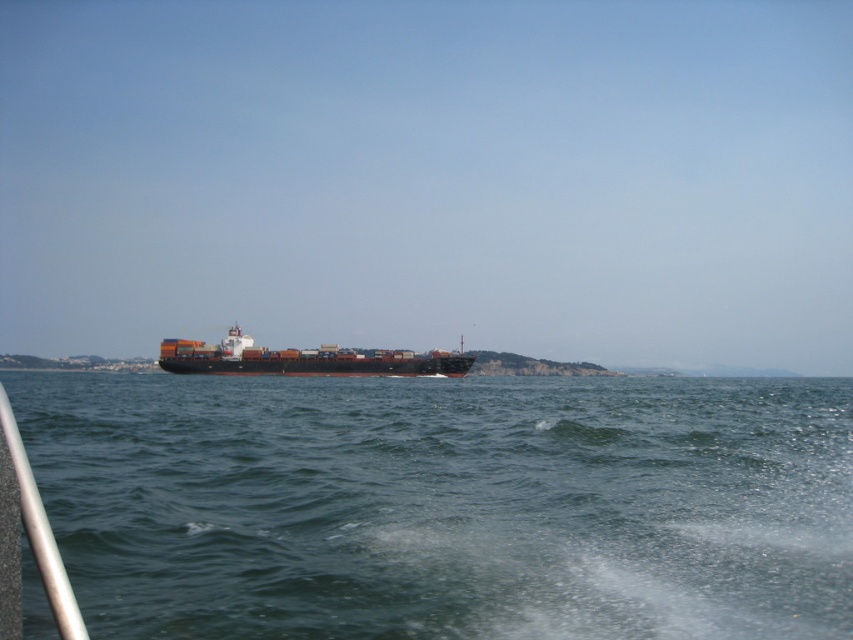
Between green water at center and brown matte container ship at center, which one appears on the right side from the viewer's perspective?

green water at center

Who is positioned more to the left, green water at center or brown matte container ship at center?

Positioned to the left is brown matte container ship at center.

The image size is (853, 640). I want to click on green water at center, so click(x=445, y=504).